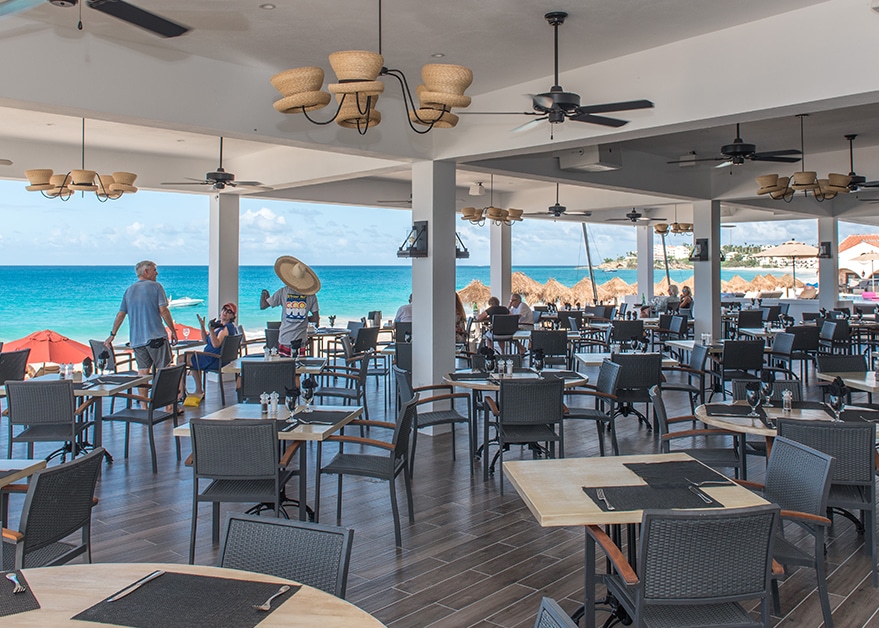
I want to click on chair, so click(x=670, y=588).